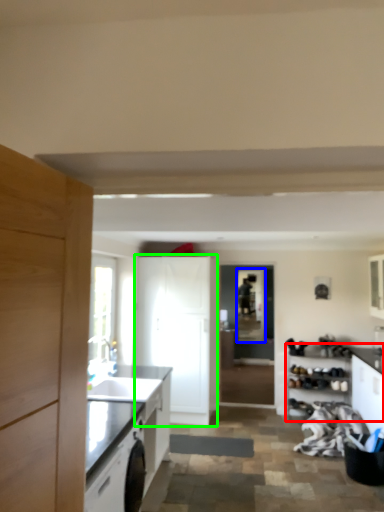
Question: Estimate the real-world distances between objects in this image. Which object is closer to cabinetry (highlighted by a red box), window screen (highlighted by a blue box) or cabinetry (highlighted by a green box)?

Choices:
 (A) window screen
 (B) cabinetry

Answer: (A)